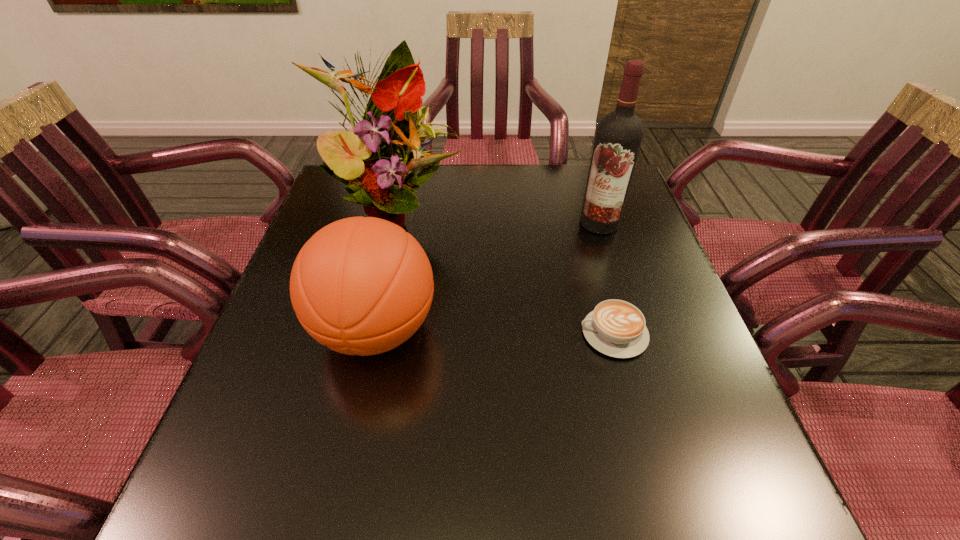
What are the coordinates of `basketball` in the screenshot? It's located at (362, 286).

Identify the location of cappuccino. This screenshot has height=540, width=960. (616, 328).

You are a GUI agent. You are given a task and a screenshot of the screen. Output one action in this format:
    pyautogui.click(x=<x>, y=<y>)
    Task: Click on the bouquet
    The image size is (960, 540).
    Given the screenshot: What is the action you would take?
    pyautogui.click(x=379, y=170)

This screenshot has height=540, width=960. What are the coordinates of `wine bottle` in the screenshot? It's located at [x=619, y=135].

This screenshot has height=540, width=960. I want to click on vacant region located on the right of the basketball, so (x=558, y=330).

Find the location of `vacant space located 0.100m on the side of the cappuccino with the handle`. vacant space located 0.100m on the side of the cappuccino with the handle is located at coordinates (531, 334).

At what (x,y) coordinates should I click in order to perform the action: click on vacant space located 0.090m on the side of the cappuccino with the handle. Please return your answer as a coordinate pair (x, y). Image resolution: width=960 pixels, height=540 pixels. Looking at the image, I should click on 536,334.

Identify the location of free space located on the side of the cappuccino with the handle. (550, 334).

I want to click on free space located 0.130m on the front-facing side of the bouquet, so click(446, 268).

Locate an element on the screen. free spot located on the front-facing side of the bouquet is located at coordinates (468, 298).